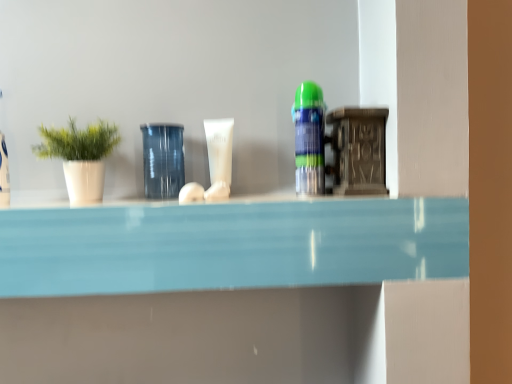
Question: In which direction should I rotate to look at translucent plastic spray can at center, which appears as the second toiletry when viewed from the left?

Choices:
 (A) left
 (B) right

Answer: (B)

Question: Does transparent glass jar at center have a larger size compared to white matte tube at center, the first toiletry positioned from the back?

Choices:
 (A) no
 (B) yes

Answer: (B)

Question: From a real-world perspective, is transparent glass jar at center under white matte tube at center, the 1th toiletry when ordered from left to right?

Choices:
 (A) yes
 (B) no

Answer: (A)

Question: Can you confirm if transparent glass jar at center is smaller than white matte tube at center, the 1th toiletry when ordered from left to right?

Choices:
 (A) no
 (B) yes

Answer: (A)

Question: Considering the relative sizes of transparent glass jar at center and white matte tube at center, arranged as the 2th toiletry when viewed from the front, in the image provided, is transparent glass jar at center thinner than white matte tube at center, arranged as the 2th toiletry when viewed from the front,?

Choices:
 (A) yes
 (B) no

Answer: (B)

Question: Is transparent glass jar at center further to camera compared to white matte tube at center, arranged as the 2th toiletry when viewed from the front?

Choices:
 (A) no
 (B) yes

Answer: (A)

Question: From the image's perspective, is transparent glass jar at center under white matte tube at center, arranged as the 2th toiletry when viewed from the right?

Choices:
 (A) yes
 (B) no

Answer: (A)

Question: Is translucent plastic spray can at center, marked as the first toiletry in a front-to-back arrangement, to the right of white matte tube at center, arranged as the 2th toiletry when viewed from the front, from the viewer's perspective?

Choices:
 (A) yes
 (B) no

Answer: (A)

Question: Can you confirm if translucent plastic spray can at center, which appears as the first toiletry when viewed from the right, is bigger than white matte tube at center, the first toiletry positioned from the back?

Choices:
 (A) no
 (B) yes

Answer: (B)

Question: Is translucent plastic spray can at center, which appears as the second toiletry when viewed from the left, taller than white matte tube at center, arranged as the 2th toiletry when viewed from the front?

Choices:
 (A) no
 (B) yes

Answer: (B)

Question: Does translucent plastic spray can at center, marked as the first toiletry in a front-to-back arrangement, appear on the left side of white matte tube at center, arranged as the 2th toiletry when viewed from the front?

Choices:
 (A) no
 (B) yes

Answer: (A)

Question: Could you tell me if translucent plastic spray can at center, which appears as the first toiletry when viewed from the right, is turned towards white matte tube at center, the 1th toiletry when ordered from left to right?

Choices:
 (A) yes
 (B) no

Answer: (B)

Question: Is translucent plastic spray can at center, which appears as the second toiletry when viewed from the left, thinner than white matte tube at center, arranged as the 2th toiletry when viewed from the right?

Choices:
 (A) yes
 (B) no

Answer: (B)

Question: Can you confirm if transparent glass jar at center is smaller than white matte pot at left?

Choices:
 (A) yes
 (B) no

Answer: (A)